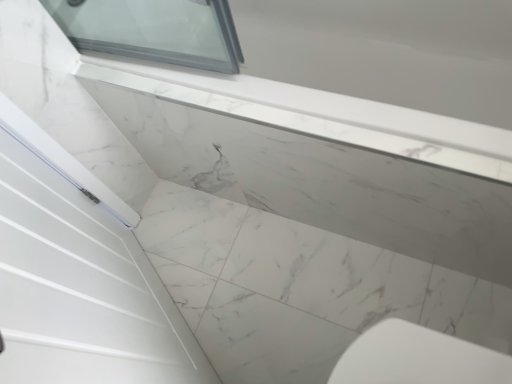
Question: In terms of height, does white marble countertop at upper center look taller or shorter compared to white marble window sill at upper center?

Choices:
 (A) short
 (B) tall

Answer: (A)

Question: From the image's perspective, is white marble countertop at upper center positioned above or below white marble window sill at upper center?

Choices:
 (A) below
 (B) above

Answer: (A)

Question: Does point (215, 273) appear closer or farther from the camera than point (441, 120)?

Choices:
 (A) farther
 (B) closer

Answer: (A)

Question: In the image, is white marble window sill at upper center on the left side or the right side of white marble countertop at upper center?

Choices:
 (A) right
 (B) left

Answer: (A)

Question: In terms of width, does white marble window sill at upper center look wider or thinner when compared to white marble countertop at upper center?

Choices:
 (A) wide
 (B) thin

Answer: (B)

Question: Based on their sizes in the image, would you say white marble window sill at upper center is bigger or smaller than white marble countertop at upper center?

Choices:
 (A) small
 (B) big

Answer: (B)

Question: Which is correct: white marble window sill at upper center is inside white marble countertop at upper center, or outside of it?

Choices:
 (A) inside
 (B) outside

Answer: (B)